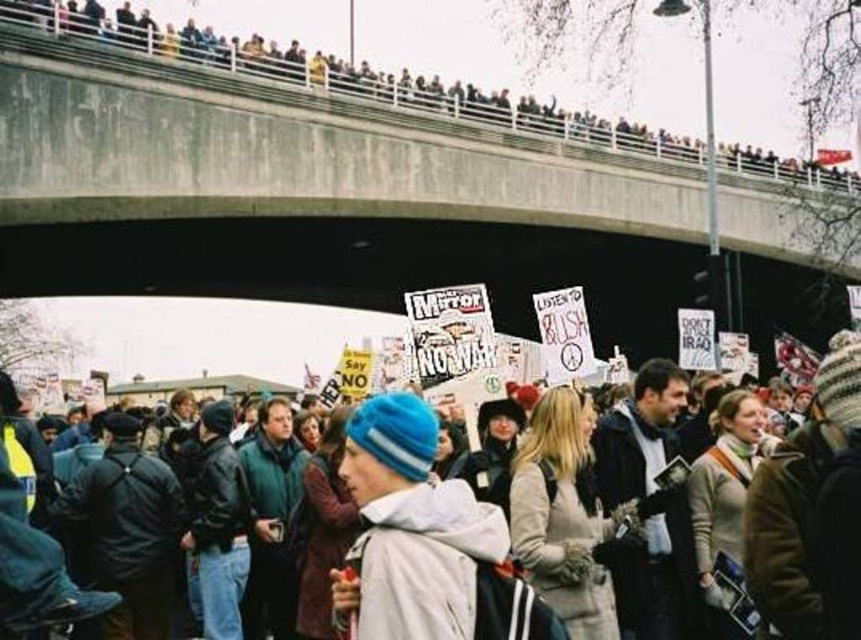
Question: Which of the following is the farthest from the observer?

Choices:
 (A) concrete bridge at upper center
 (B) blue knit cap at center

Answer: (A)

Question: Is concrete bridge at upper center thinner than blue knit cap at center?

Choices:
 (A) yes
 (B) no

Answer: (B)

Question: Is concrete bridge at upper center bigger than blue knit cap at center?

Choices:
 (A) yes
 (B) no

Answer: (A)

Question: Is concrete bridge at upper center smaller than blue knit cap at center?

Choices:
 (A) yes
 (B) no

Answer: (B)

Question: Which object is farther from the camera taking this photo?

Choices:
 (A) blue knit cap at center
 (B) concrete bridge at upper center

Answer: (B)